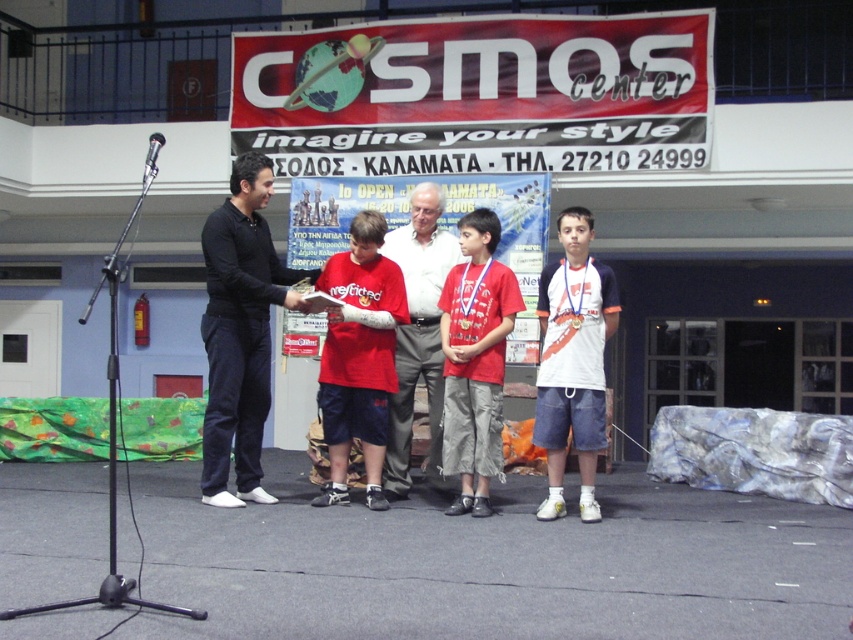
What are the coordinates of the black matte shirt at left?

The black matte shirt at left is located at point [239,332].